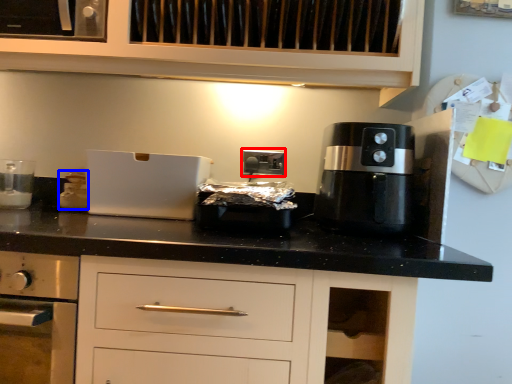
Question: Which object appears closest to the camera in this image, electric outlet (highlighted by a red box) or kitchen appliance (highlighted by a blue box)?

Choices:
 (A) electric outlet
 (B) kitchen appliance

Answer: (B)